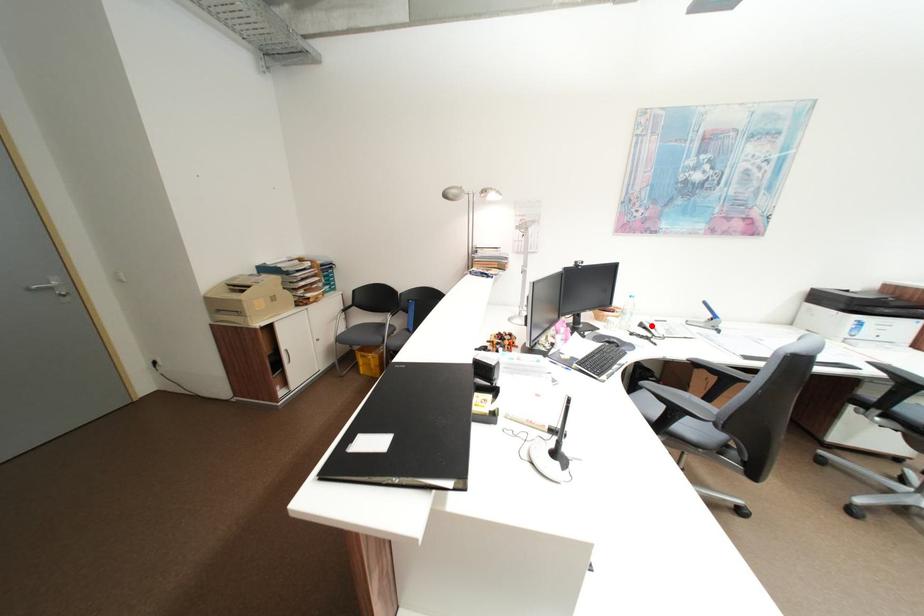
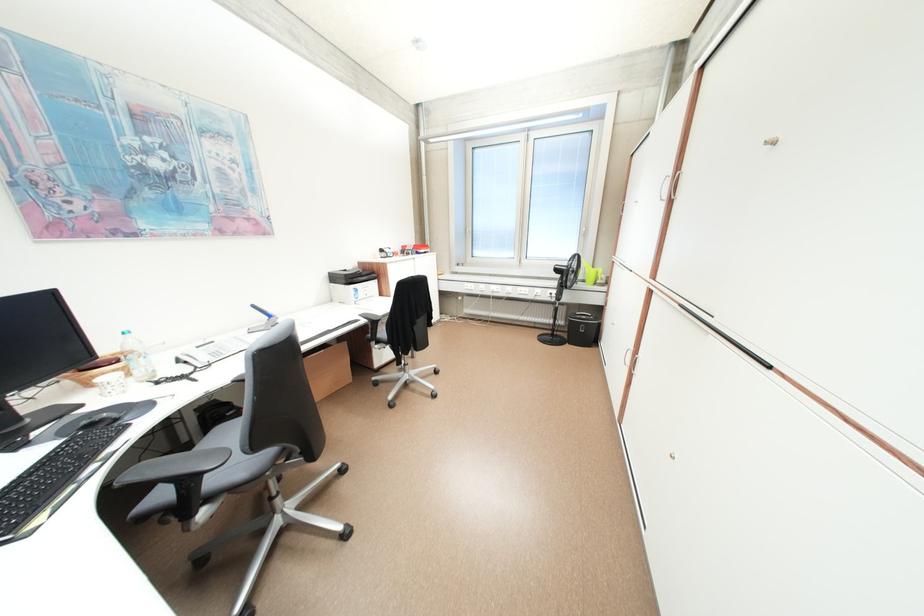
Find the pixel in the second image that matches the highlighted location in the first image.

(188, 362)